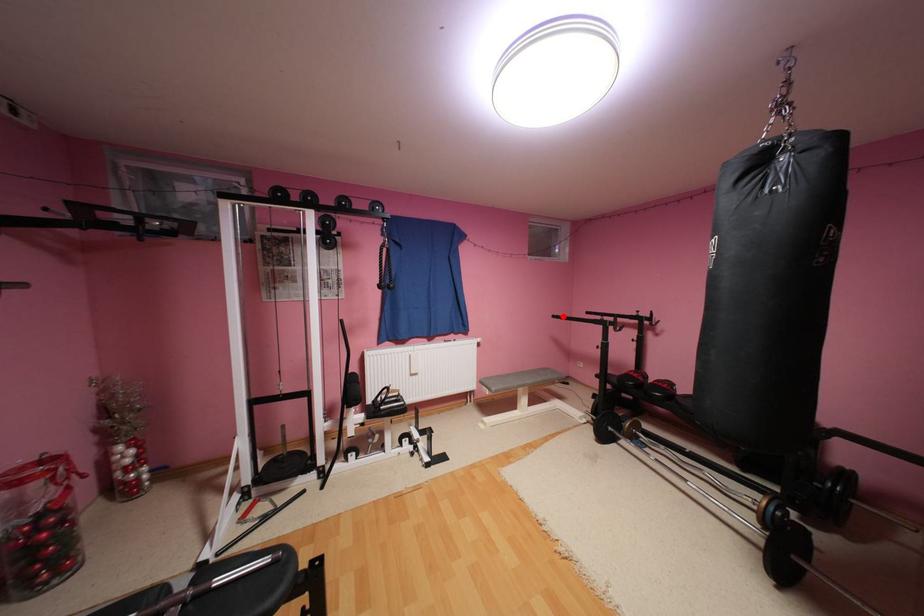
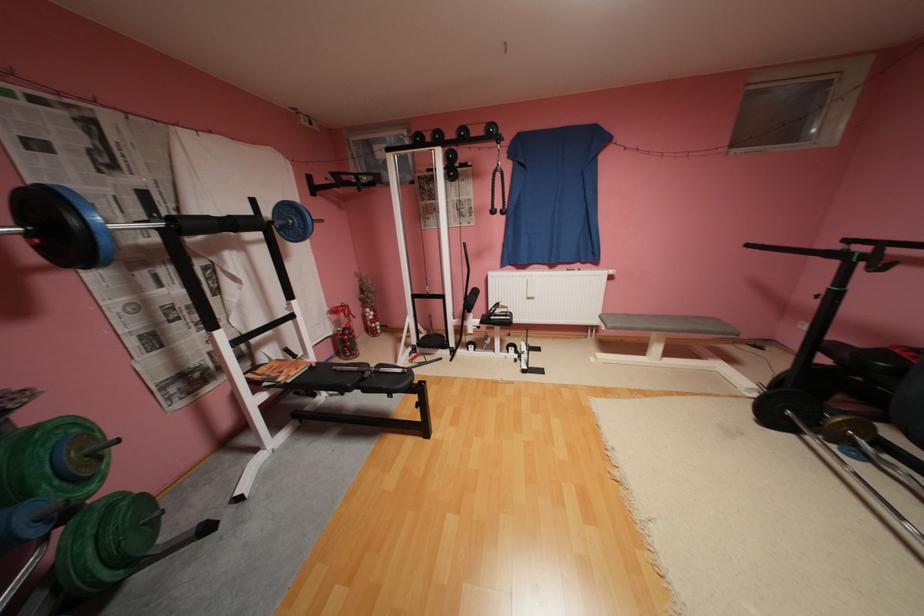
Locate, in the second image, the point that corresponds to the highlighted location in the first image.

(757, 246)